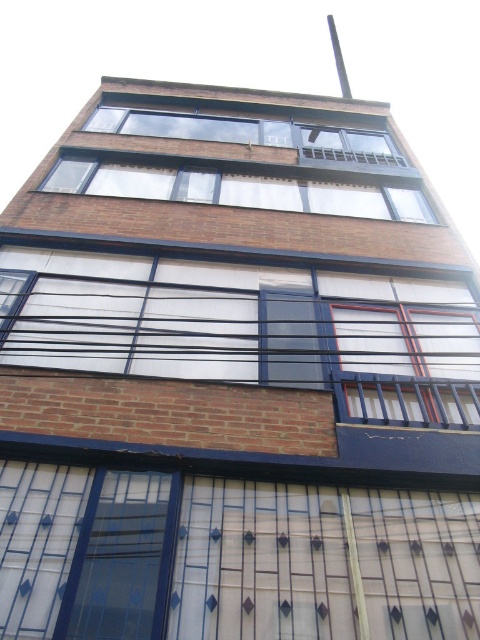
Can you confirm if white matte window at center is positioned to the left of clear glass window at upper center?

Incorrect, white matte window at center is not on the left side of clear glass window at upper center.

From the picture: Is white matte window at center above clear glass window at upper center?

No.

This screenshot has width=480, height=640. Find the location of `white matte window at center`. white matte window at center is located at coordinates coord(249,330).

Locate an element on the screen. white matte window at center is located at coordinates (249, 330).

Is clear glass windows at upper center above clear glass window at upper center?

No.

Can you confirm if clear glass windows at upper center is wider than clear glass window at upper center?

Correct, the width of clear glass windows at upper center exceeds that of clear glass window at upper center.

Find the location of `clear glass windows at upper center`. clear glass windows at upper center is located at coordinates (237, 189).

This screenshot has height=640, width=480. Identify the location of clear glass windows at upper center. click(237, 189).

Is white matte window at center positioned in front of clear glass windows at upper center?

Yes, white matte window at center is closer to the viewer.

Is point (362, 417) closer to camera compared to point (215, 195)?

Yes.

This screenshot has height=640, width=480. I want to click on white matte window at center, so click(x=249, y=330).